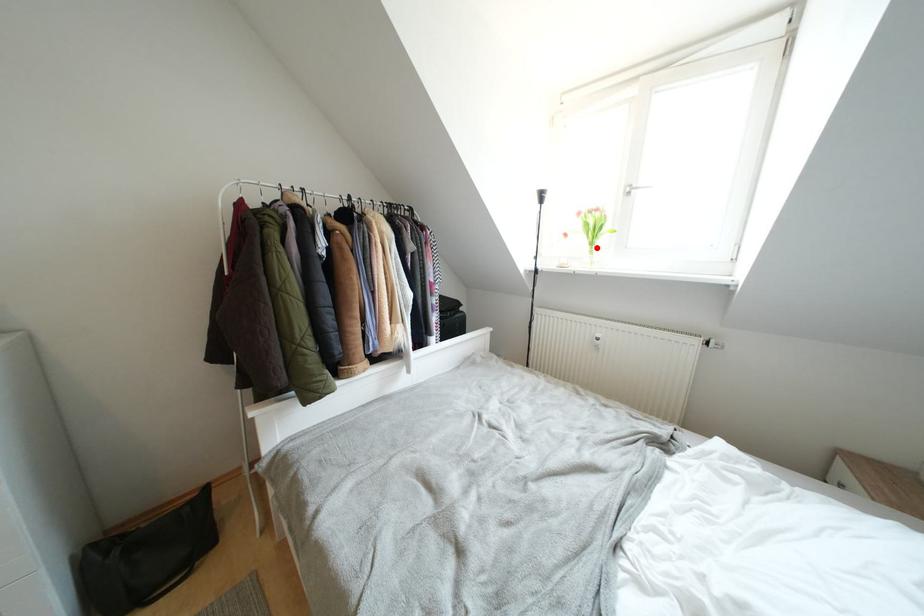
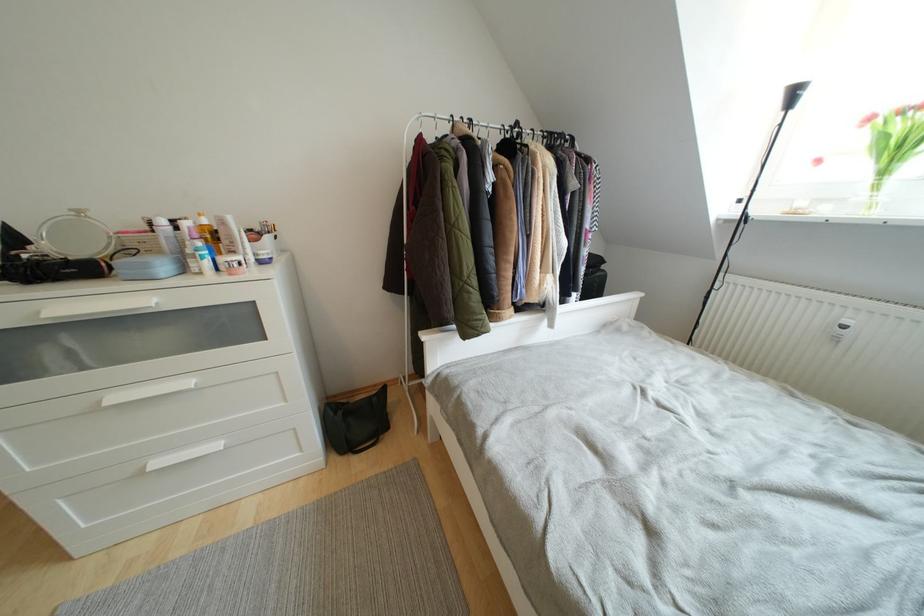
Question: I am providing you with two images of the same scene from different viewpoints. Given a red point in image1, look at the same physical point in image2. Is it:

Choices:
 (A) Closer to the viewpoint
 (B) Farther from the viewpoint

Answer: (B)